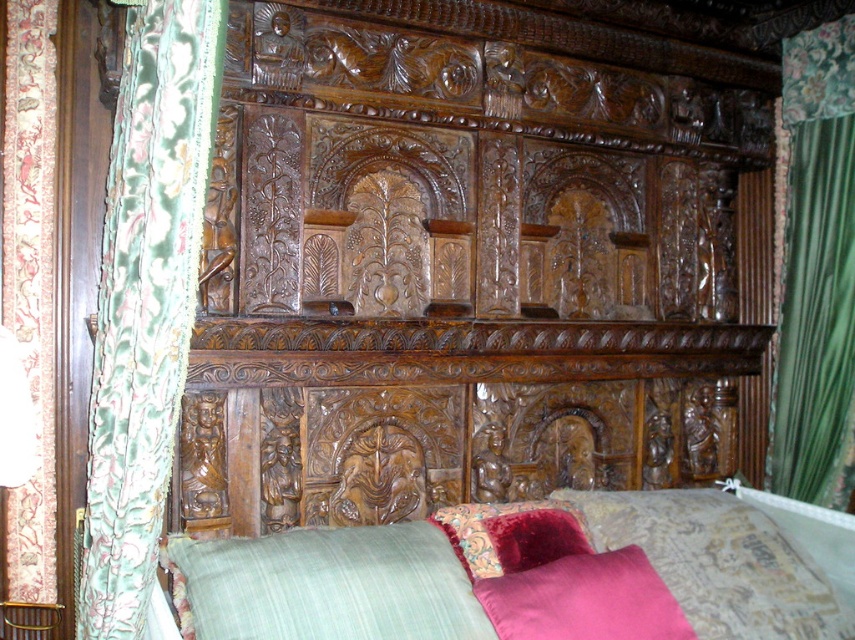
Question: Among these objects, which one is nearest to the camera?

Choices:
 (A) velvet fabric curtain at left
 (B) green fabric pillow at lower center
 (C) velvet pink pillow at lower right
 (D) velvet green curtain at right

Answer: (B)

Question: Can you confirm if green fabric pillow at lower center is smaller than velvet-like pink pillow at center?

Choices:
 (A) yes
 (B) no

Answer: (B)

Question: Is velvet green curtain at right positioned before green fabric pillow at lower center?

Choices:
 (A) yes
 (B) no

Answer: (B)

Question: Where is velvet pink pillow at lower right located in relation to velvet-like pink pillow at center in the image?

Choices:
 (A) left
 (B) right

Answer: (B)

Question: Which point is farther to the camera?

Choices:
 (A) coord(36,93)
 (B) coord(484,547)

Answer: (A)

Question: Which point appears closest to the camera in this image?

Choices:
 (A) (773, 547)
 (B) (28, 360)

Answer: (B)